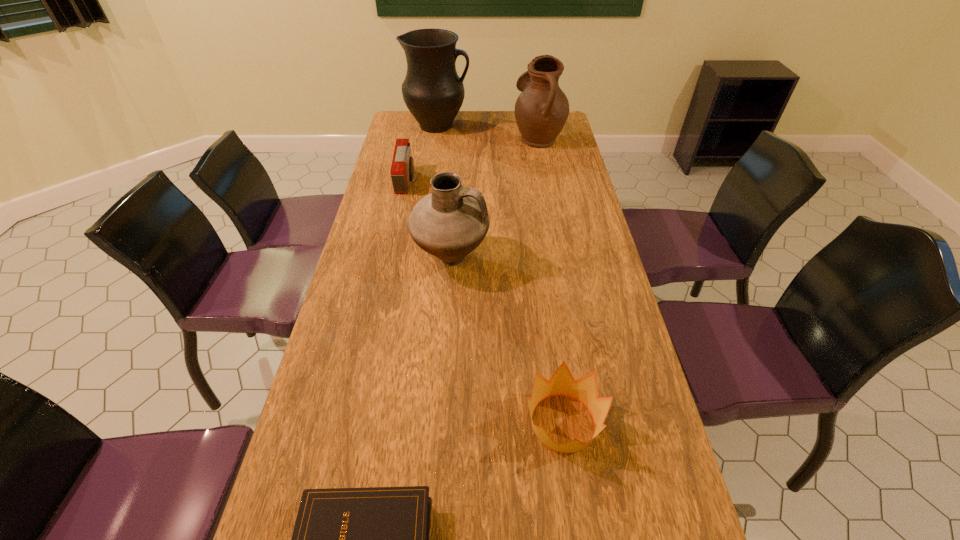
Find the location of a particular element. The width and height of the screenshot is (960, 540). the rightmost pitcher is located at coordinates (541, 110).

At what (x,y) coordinates should I click in order to perform the action: click on the nearest pitcher. Please return your answer as a coordinate pair (x, y). Looking at the image, I should click on (452, 221).

Image resolution: width=960 pixels, height=540 pixels. Identify the location of the third nearest object. (452, 221).

Image resolution: width=960 pixels, height=540 pixels. What are the coordinates of `camera` in the screenshot? It's located at (402, 169).

Where is `crown`? The width and height of the screenshot is (960, 540). crown is located at coordinates (584, 390).

Image resolution: width=960 pixels, height=540 pixels. Identify the location of vacant space situated 0.400m at the spout of the rightmost pitcher. (416, 138).

The width and height of the screenshot is (960, 540). I want to click on free spot located 0.260m at the spout of the rightmost pitcher, so click(449, 138).

Identify the location of free space located at the spout of the rightmost pitcher. The width and height of the screenshot is (960, 540). coord(433,138).

Where is `blank space located 0.300m on the handle side of the shortest pitcher`? The width and height of the screenshot is (960, 540). blank space located 0.300m on the handle side of the shortest pitcher is located at coordinates (590, 259).

The image size is (960, 540). I want to click on free space located on the front-facing side of the fourth nearest object, so click(496, 181).